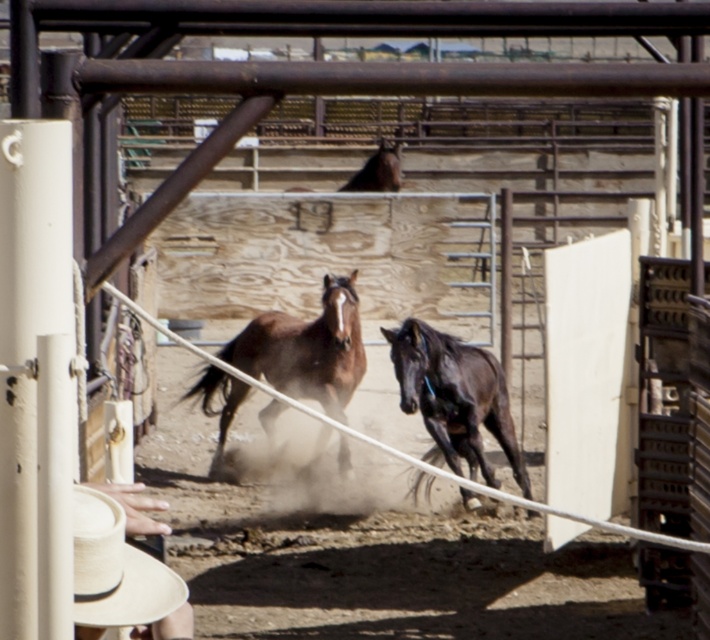
Does natural straw cowboy hat at lower left have a greater width compared to brown glossy horse at upper center?

In fact, natural straw cowboy hat at lower left might be narrower than brown glossy horse at upper center.

Is point (129, 512) positioned in front of point (386, 179)?

Yes, it is.

At what (x,y) coordinates should I click in order to perform the action: click on natural straw cowboy hat at lower left. Please return your answer as a coordinate pair (x, y). The height and width of the screenshot is (640, 710). Looking at the image, I should click on (131, 508).

From the picture: Can you confirm if shiny black horse at center is shorter than brown glossy horse at upper center?

Incorrect, shiny black horse at center's height does not fall short of brown glossy horse at upper center's.

Is point (458, 365) in front of point (381, 148)?

Yes, point (458, 365) is in front of point (381, 148).

Does point (430, 394) come closer to viewer compared to point (365, 177)?

Yes, it is in front of point (365, 177).

The height and width of the screenshot is (640, 710). I want to click on shiny black horse at center, so pos(454,397).

Which is more to the left, brown glossy horse at center or shiny black horse at center?

Positioned to the left is brown glossy horse at center.

You are a GUI agent. You are given a task and a screenshot of the screen. Output one action in this format:
    pyautogui.click(x=<x>, y=<y>)
    Task: Click on the brown glossy horse at center
    This screenshot has height=640, width=710.
    Given the screenshot: What is the action you would take?
    pyautogui.click(x=305, y=348)

Identify the location of brown glossy horse at center. The image size is (710, 640). (305, 348).